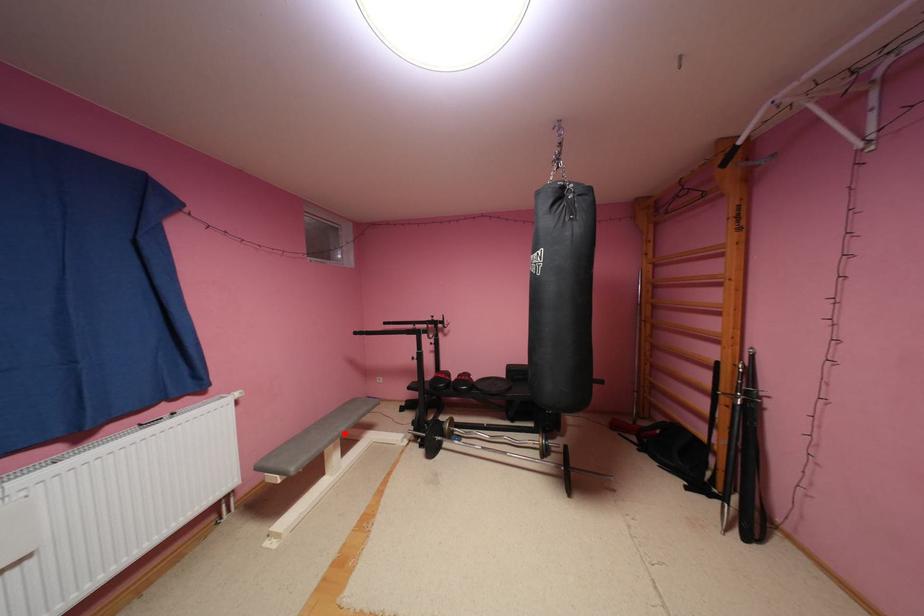
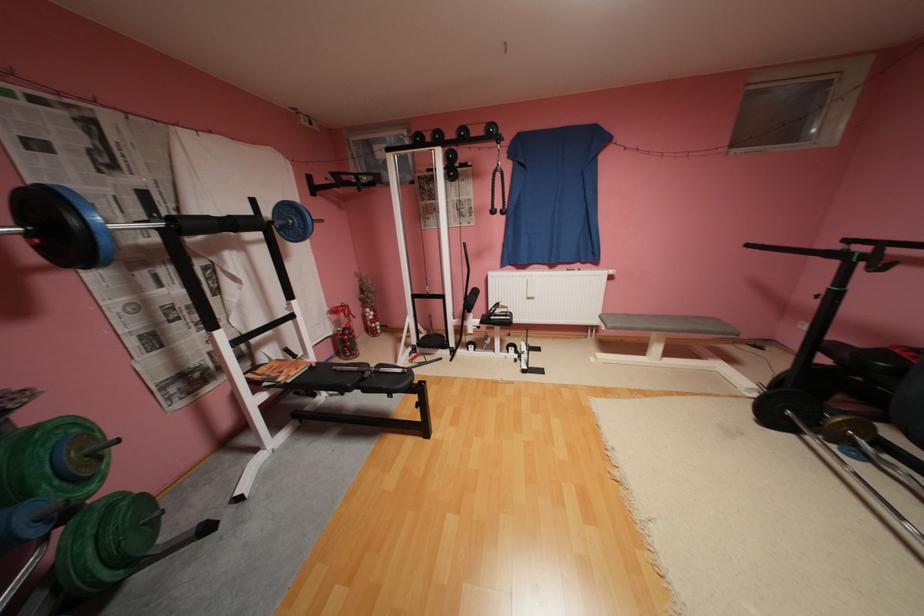
Locate, in the second image, the point that corresponds to the highlighted location in the first image.

(664, 326)